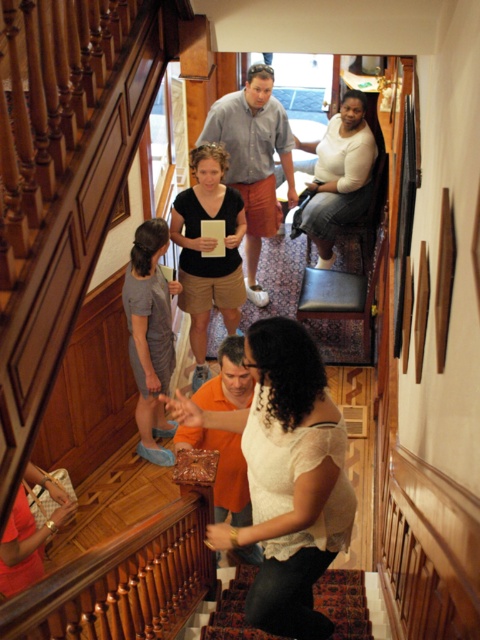
You are standing at the top of the carpeted stairs at center and want to walk down to the bottom. There is a person wearing a white lace blouse at center in your path. Can you pass them easily?

The white lace blouse at center might be wider than the carpeted stairs at center, so passing them might be difficult depending on the actual width of both.

You are standing at the bottom of the staircase and want to find the person wearing the matte black shirt at center. According to the coordinates provided, in which direction should you look to locate them?

The matte black shirt at center is located at point coordinates, so you should look towards the center area of the image to find them.